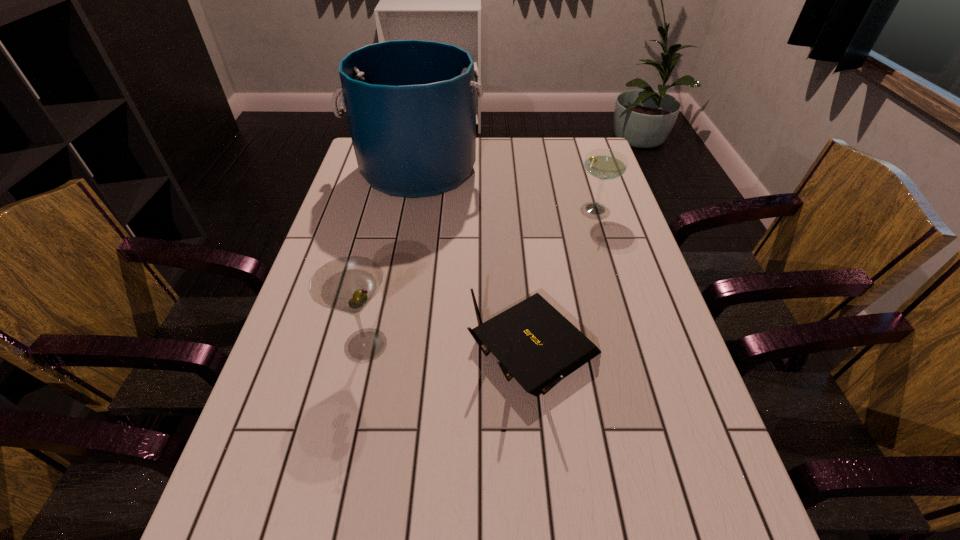
Find the location of `the tallest object`. the tallest object is located at coordinates (410, 104).

This screenshot has width=960, height=540. Find the location of `the taller martini`. the taller martini is located at coordinates (347, 284).

This screenshot has height=540, width=960. I want to click on the left martini, so click(x=347, y=284).

Locate an element on the screen. the farther martini is located at coordinates (604, 164).

Find the location of a particular element. the second shortest object is located at coordinates (604, 164).

The image size is (960, 540). Identify the location of the shortest object. [x=536, y=344].

You are a GUI agent. You are given a task and a screenshot of the screen. Output one action in this format:
    pyautogui.click(x=<x>, y=<y>)
    Task: Click on the free spot located on the right of the bucket
    Image resolution: width=960 pixels, height=540 pixels.
    Given the screenshot: What is the action you would take?
    pyautogui.click(x=513, y=170)

Where is `free space located 0.050m on the front of the second tallest object`? This screenshot has height=540, width=960. free space located 0.050m on the front of the second tallest object is located at coordinates (355, 394).

Locate an element on the screen. vacant area located on the left of the third tallest object is located at coordinates (480, 209).

You are a GUI agent. You are given a task and a screenshot of the screen. Output one action in this format:
    pyautogui.click(x=<x>, y=<y>)
    Task: Click on the vacant space situated on the back of the shortest object
    This screenshot has width=960, height=540.
    Given the screenshot: What is the action you would take?
    pyautogui.click(x=519, y=206)